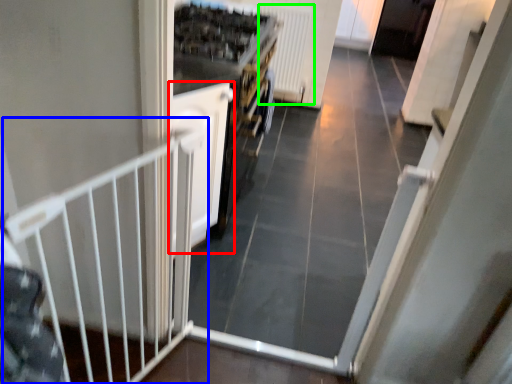
Question: Which object is the closest to the door (highlighted by a red box)? Choose among these: rail (highlighted by a blue box) or radiator (highlighted by a green box).

Choices:
 (A) rail
 (B) radiator

Answer: (A)